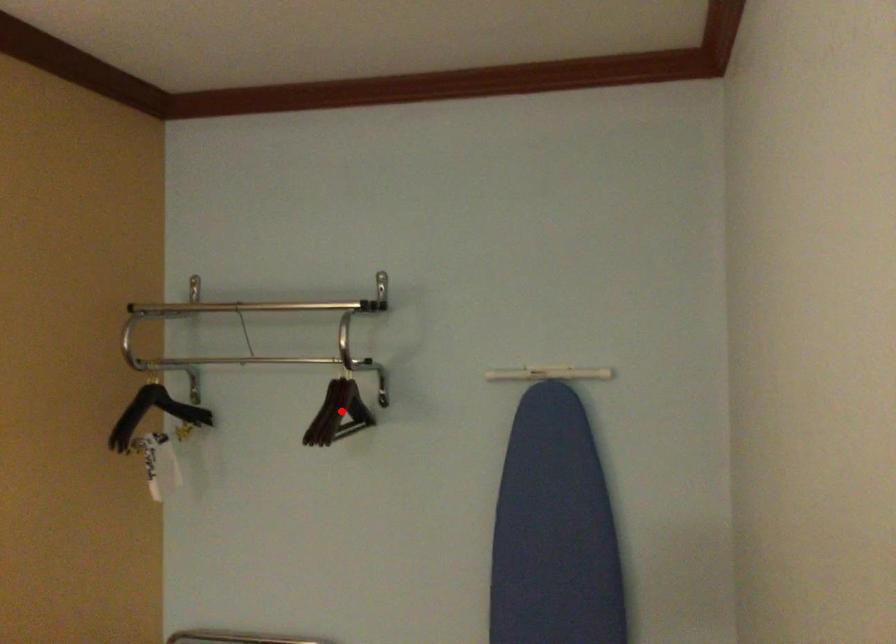
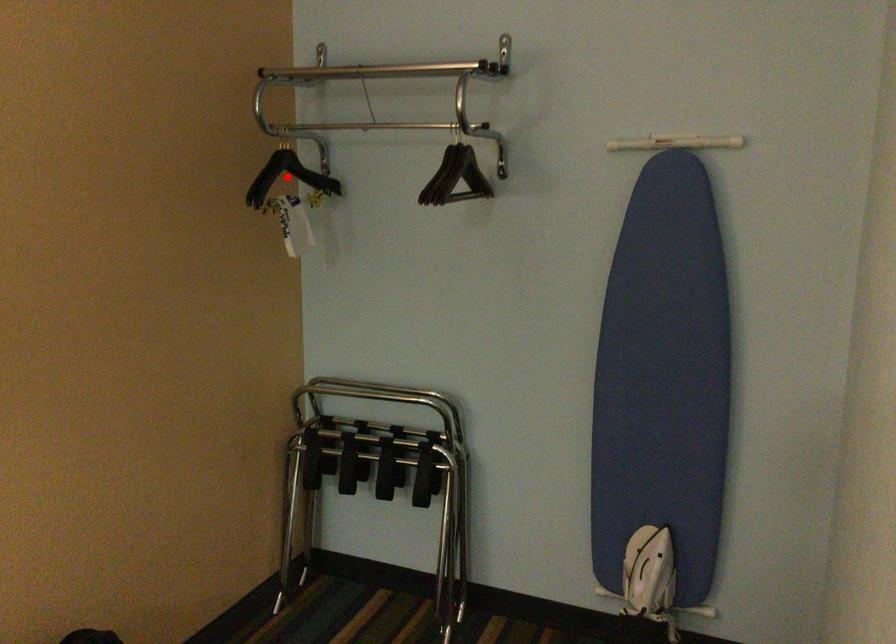
I am providing you with two images of the same scene from different viewpoints. A red point is marked on the first image and another point is marked on the second image. Is the red point in image1 aligned with the point shown in image2?

No